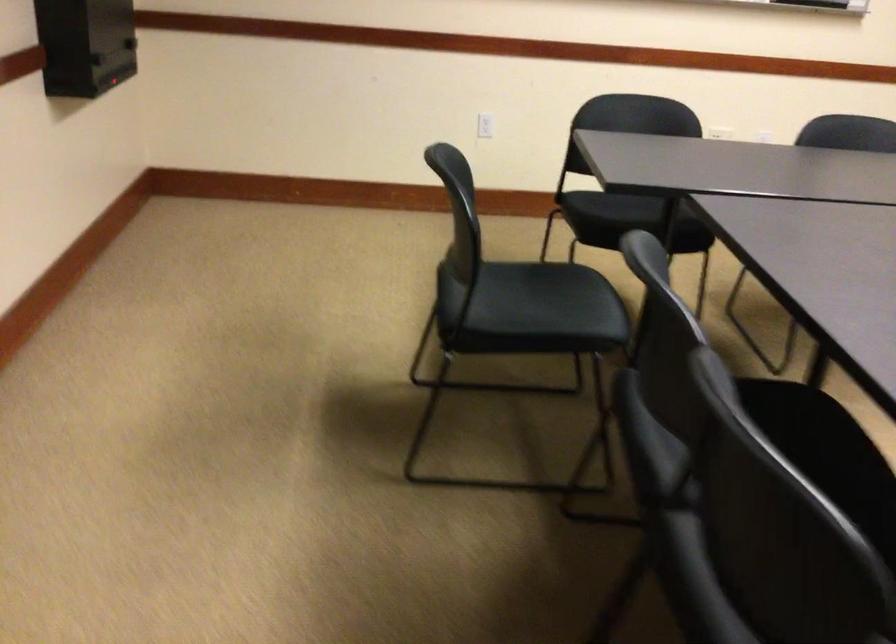
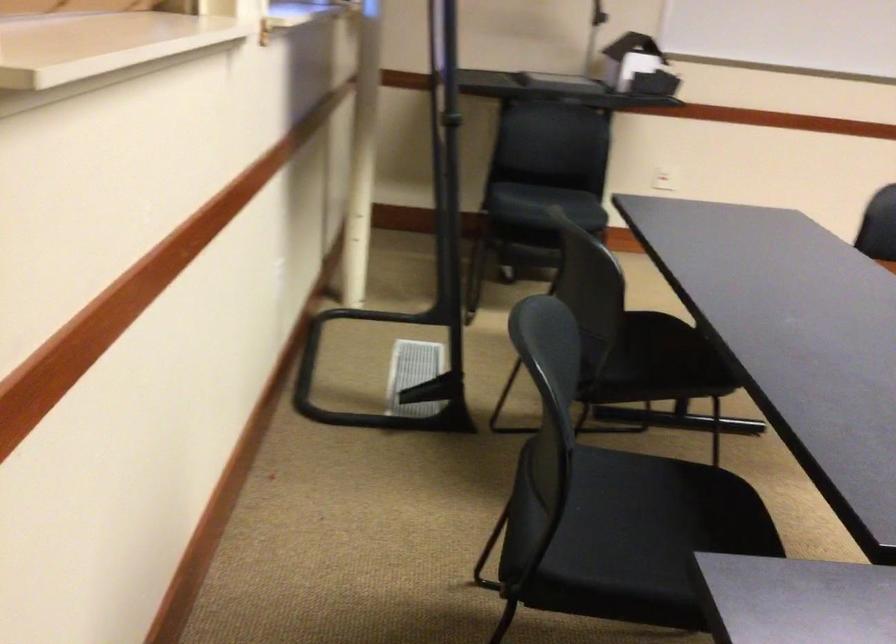
First-person continuous shooting, in which direction is the camera rotating?

The camera rotated toward right-down.